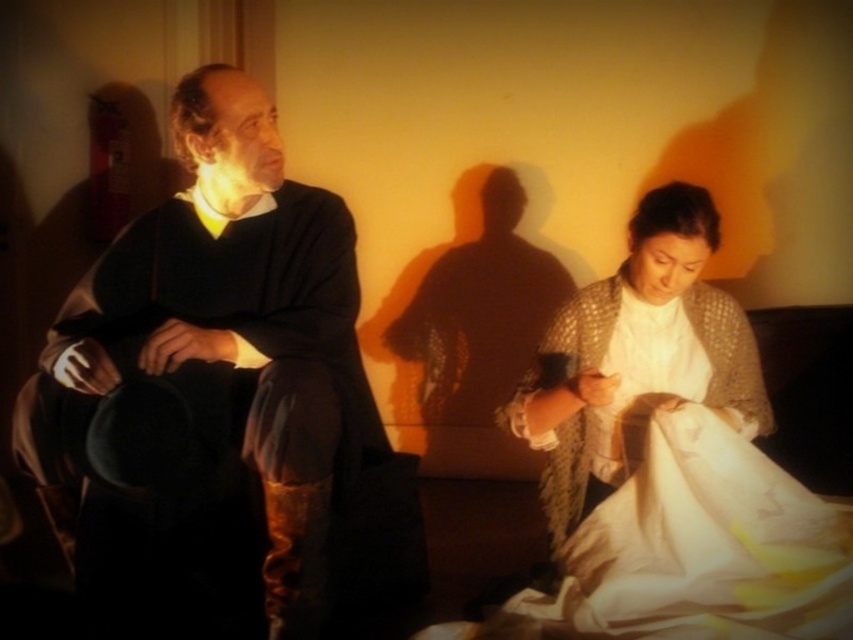
From the picture: You are an interior designer assessing the placement of objects in the room. The matte black hat at left is positioned at coordinates 0.547 on the horizontal axis and 0.253 on the vertical axis. If you were to place a decorative item exactly at the center of the room, would the hat be closer to the left wall or the right wall?

The matte black hat at left is located at point 0.547 on the horizontal axis. Since the center of the room is at 0.5, the hat is slightly to the right of center, meaning it is closer to the right wall than the left wall.

You are a photographer setting up a shoot in this dimly lit room. You want to place a 24 inch wide light panel between the matte black hat at left and the white textured shawl at lower right. Will the light panel fit between them without overlapping either object?

The distance between the matte black hat at left and the white textured shawl at lower right is 25.23 inches. Since the light panel is 24 inches wide, it will fit between them with approximately 1.23 inches of space remaining on either side.

You are an interior designer analyzing the lighting in the room. You notice a point at coordinates (x=215, y=349). Which object does this point belong to?

The point at coordinates (x=215, y=349) belongs to the matte black hat at left.